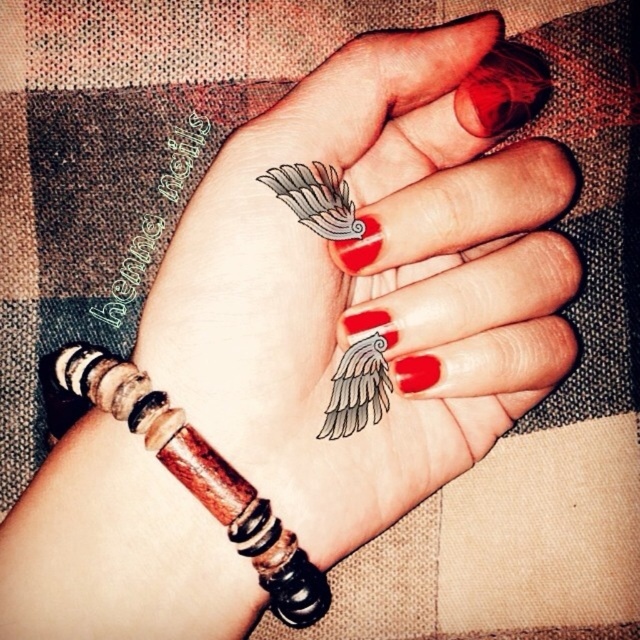
Question: Estimate the real-world distances between objects in this image. Which object is closer to the white matte wing at center?

Choices:
 (A) matte black wings at center
 (B) gray ink wing at center
 (C) wooden beaded bracelet at lower left

Answer: (B)

Question: Which object is positioned farthest from the gray ink wing at center?

Choices:
 (A) matte black wings at center
 (B) white matte wing at center

Answer: (B)

Question: Does matte black wings at center lie behind white matte wing at center?

Choices:
 (A) yes
 (B) no

Answer: (B)

Question: Does gray ink wing at center appear on the right side of white matte wing at center?

Choices:
 (A) yes
 (B) no

Answer: (A)

Question: Is matte black wings at center below gray ink wing at center?

Choices:
 (A) no
 (B) yes

Answer: (A)

Question: Which point is farther from the camera taking this photo?

Choices:
 (A) (371, 356)
 (B) (337, 212)
 (C) (289, 588)
 (D) (426, 164)

Answer: (D)